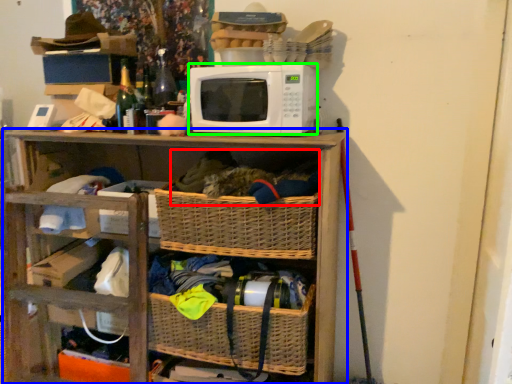
Question: Which object is positioned closest to material (highlighted by a red box)? Select from shelf (highlighted by a blue box) and microwave oven (highlighted by a green box).

Choices:
 (A) shelf
 (B) microwave oven

Answer: (B)